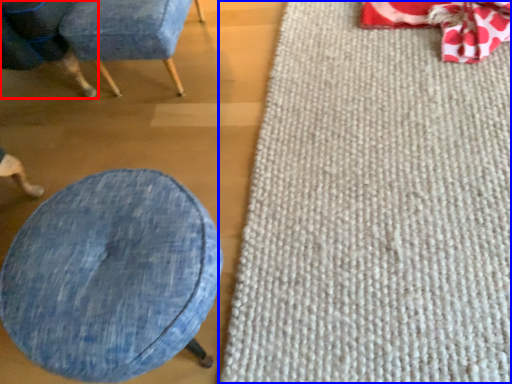
Question: Which object is closer to the camera taking this photo, chair (highlighted by a red box) or mat (highlighted by a blue box)?

Choices:
 (A) chair
 (B) mat

Answer: (B)